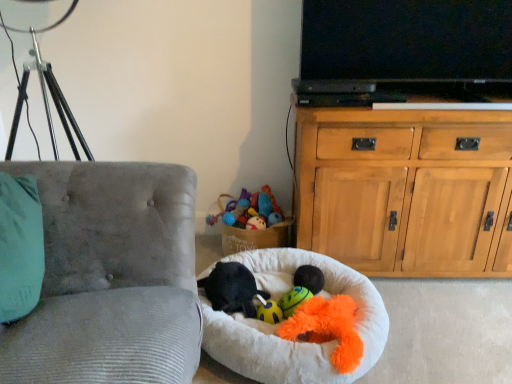
This screenshot has height=384, width=512. Identify the location of empty space that is ontop of fluffy orange plush toy at center, which is the first toy in front-to-back order (from a real-world perspective). (323, 323).